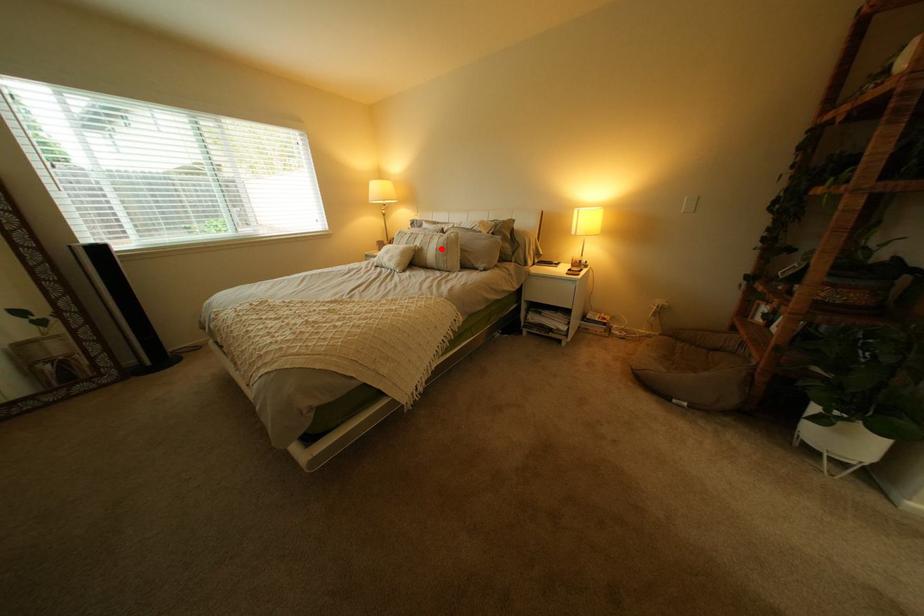
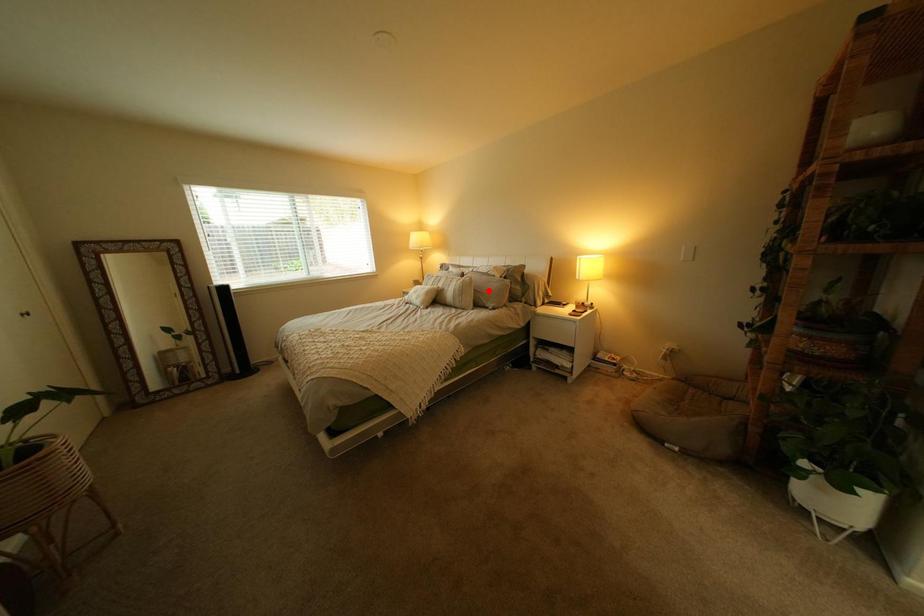
I am providing you with two images of the same scene from different viewpoints. A red point is marked on the first image and another point is marked on the second image. Do the highlighted points in image1 and image2 indicate the same real-world spot?

No